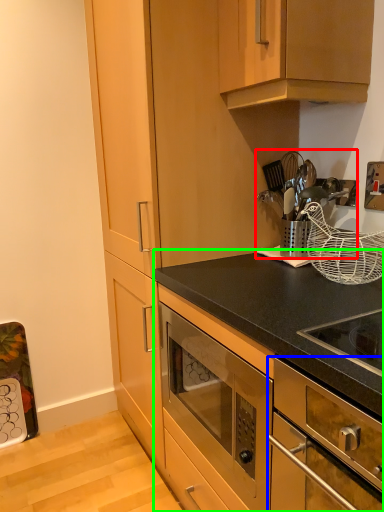
Question: Which object is the farthest from appliance (highlighted by a red box)? Choose among these: oven (highlighted by a blue box) or cabinetry (highlighted by a green box).

Choices:
 (A) oven
 (B) cabinetry

Answer: (A)